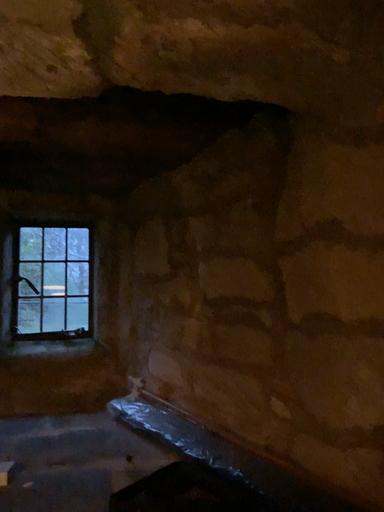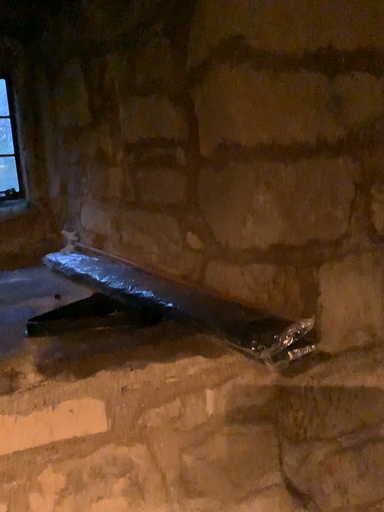
Question: Which way did the camera rotate in the video?

Choices:
 (A) rotated upward
 (B) rotated downward

Answer: (B)